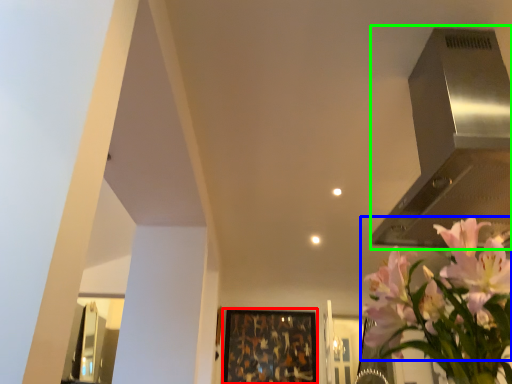
Question: Estimate the real-world distances between objects in this image. Which object is farther from picture frame (highlighted by a red box), flower (highlighted by a blue box) or vent (highlighted by a green box)?

Choices:
 (A) flower
 (B) vent

Answer: (A)